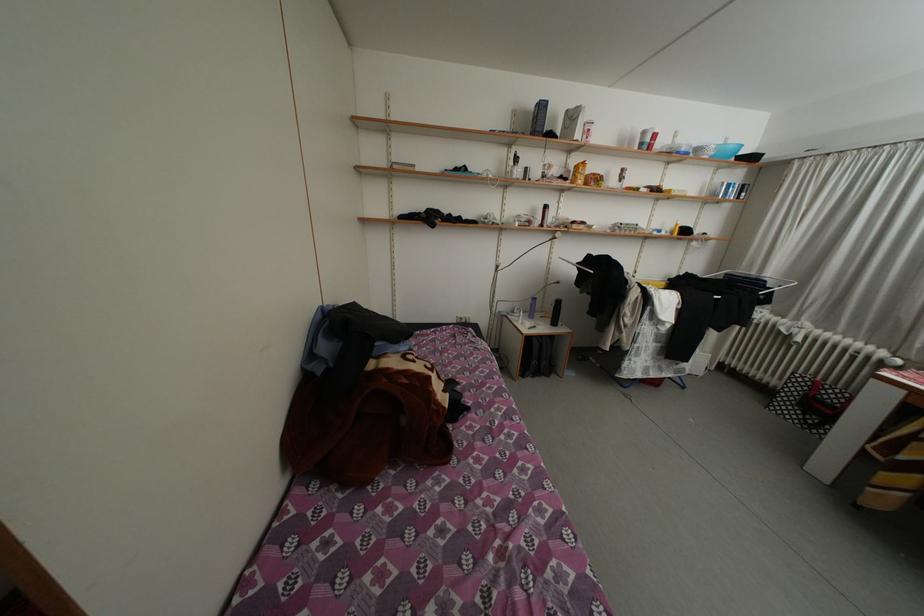
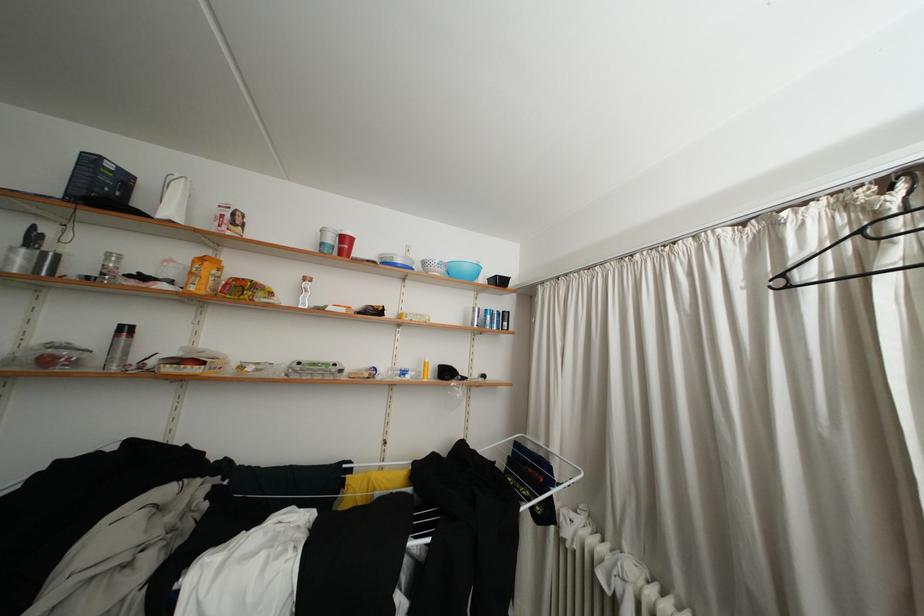
Where in the second image is the point corresponding to point 650,148 from the first image?

(330, 249)